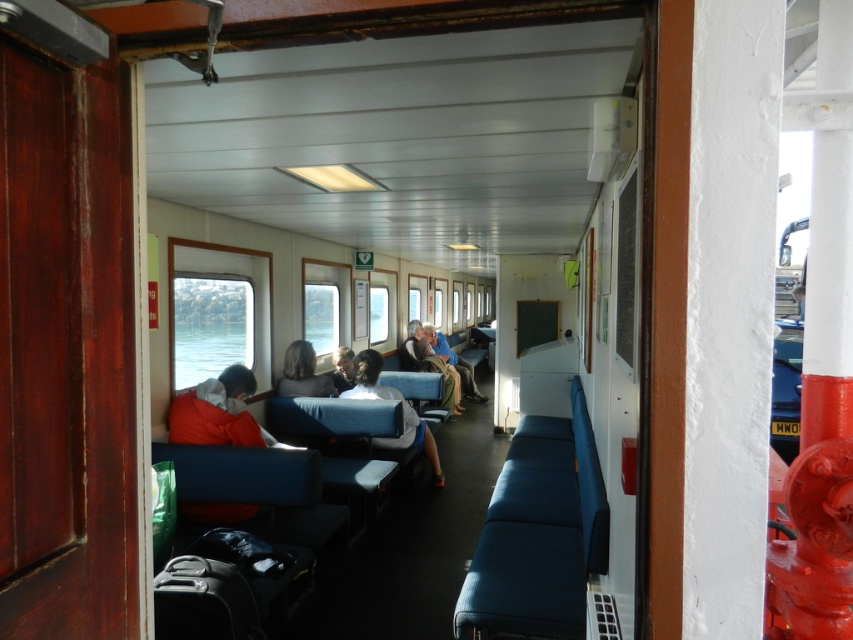
You are a passenger on the ferry and see two jackets hanging on hooks in the cabin. The light brown leather jacket at center and the blue fabric jacket at center. Which jacket is placed higher?

The light brown leather jacket at center is above the blue fabric jacket at center, so it is placed higher.

You are a passenger on the ferry and need to store your jacket in the cabin. There is a hook above the central aisle. Can you hang both the light brown leather jacket at center and the blue fabric jacket at center on the same hook without one overlapping the other?

The light brown leather jacket at center has a smaller size compared to blue fabric jacket at center. Since the blue fabric jacket is larger, it will require more space on the hook. Therefore, both jackets can be hung on the same hook, but the larger blue fabric jacket at center should be placed first to ensure there is enough space for the smaller light brown leather jacket at center.

You are a passenger on the ferry and want to place your gray fabric jacket at center and smooth gray shirt at center on the bench. Which item will occupy more space horizontally?

The gray fabric jacket at center is wider than the smooth gray shirt at center, so it will occupy more horizontal space.